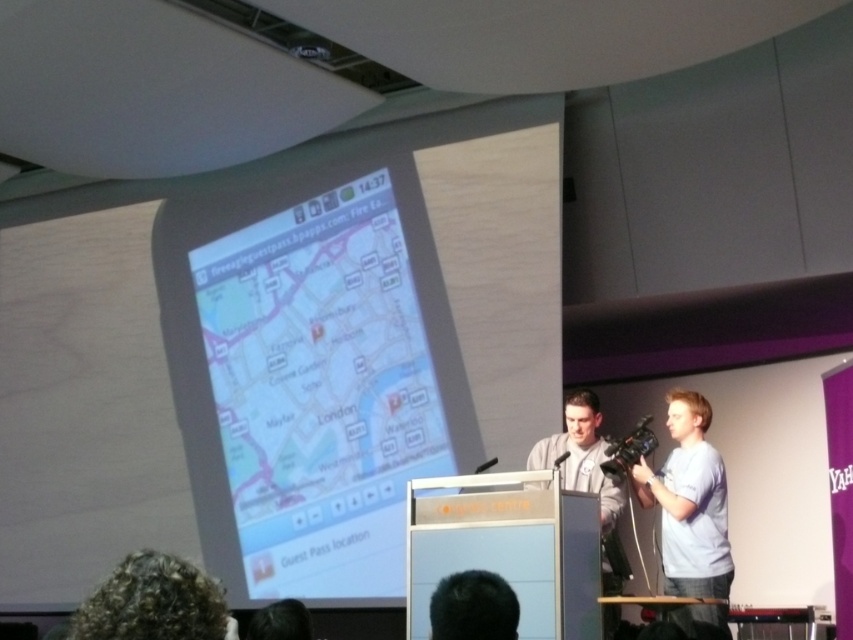
Question: Which object appears farthest from the camera in this image?

Choices:
 (A) light blue cotton shirt at right
 (B) transparent plastic map at center
 (C) dark brown hair at lower center

Answer: (B)

Question: Which point is closer to the camera?

Choices:
 (A) (300, 637)
 (B) (701, 605)
 (C) (96, 602)
 (D) (282, 269)

Answer: (C)

Question: Does transparent plastic map at center come in front of light blue cotton shirt at right?

Choices:
 (A) yes
 (B) no

Answer: (B)

Question: Does curly hair at lower left have a lesser width compared to dark brown hair at lower center?

Choices:
 (A) no
 (B) yes

Answer: (A)

Question: Can you confirm if curly hair at lower left is positioned to the left of dark brown hair at lower center?

Choices:
 (A) yes
 (B) no

Answer: (A)

Question: Which point is farther to the camera?

Choices:
 (A) light blue cotton shirt at right
 (B) transparent plastic map at center

Answer: (B)